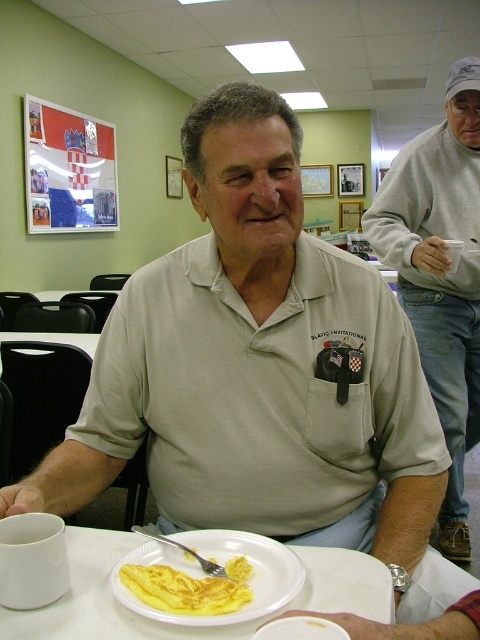
Question: Estimate the real-world distances between objects in this image. Which object is farther from the silver metallic fork at plate center?

Choices:
 (A) white paper plate at lower center
 (B) white matte plate at lower center

Answer: (A)

Question: Observing the image, what is the correct spatial positioning of white matte plate at lower center in reference to silver metallic fork at plate center?

Choices:
 (A) right
 (B) left

Answer: (A)

Question: Which object appears farthest from the camera in this image?

Choices:
 (A) white matte plate at lower center
 (B) beige cotton shirt at center
 (C) silver metallic fork at plate center
 (D) yellow soft omelette at lower center

Answer: (B)

Question: Can you confirm if yellow soft omelette at lower center is positioned to the right of silver metallic fork at plate center?

Choices:
 (A) yes
 (B) no

Answer: (A)

Question: Is beige cotton polo shirt at center further to the viewer compared to beige cotton shirt at center?

Choices:
 (A) yes
 (B) no

Answer: (B)

Question: Considering the real-world distances, which object is farthest from the beige cotton polo shirt at center?

Choices:
 (A) yellow soft omelette at lower center
 (B) white matte plate at lower center

Answer: (A)